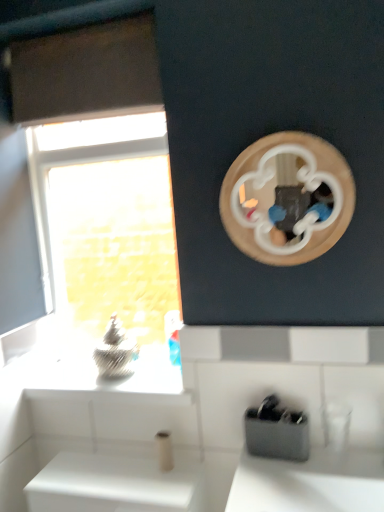
Question: Relative to black plastic toothbrush holder at lower center, is transparent glass window at left in front or behind?

Choices:
 (A) front
 (B) behind

Answer: (B)

Question: From the image's perspective, is transparent glass window at left located above or below black plastic toothbrush holder at lower center?

Choices:
 (A) above
 (B) below

Answer: (A)

Question: Is transparent glass window at left spatially inside black plastic toothbrush holder at lower center, or outside of it?

Choices:
 (A) outside
 (B) inside

Answer: (A)

Question: In terms of width, does black plastic toothbrush holder at lower center look wider or thinner when compared to transparent glass window at left?

Choices:
 (A) thin
 (B) wide

Answer: (B)

Question: Which is correct: black plastic toothbrush holder at lower center is inside transparent glass window at left, or outside of it?

Choices:
 (A) inside
 (B) outside

Answer: (B)

Question: From a real-world perspective, is black plastic toothbrush holder at lower center positioned above or below transparent glass window at left?

Choices:
 (A) above
 (B) below

Answer: (B)

Question: Considering the positions of black plastic toothbrush holder at lower center and transparent glass window at left in the image, is black plastic toothbrush holder at lower center bigger or smaller than transparent glass window at left?

Choices:
 (A) small
 (B) big

Answer: (A)